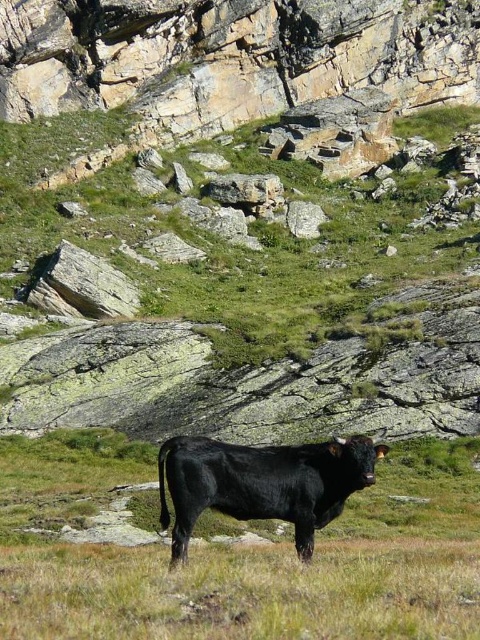
You are a wildlife photographer aiming to capture the black smooth cow at center and the black smooth bull at center in the same frame. Based on their sizes, which animal should you focus on first to ensure both fit in the photo?

The black smooth cow at center is not as tall as the black smooth bull at center, so you should focus on the black smooth bull at center first to ensure both fit in the photo.

You are a hiker who wants to take a photo of the black smooth cow at center and the black smooth bull at center. Which one should you focus on first if you want to capture both in the same frame without moving your camera?

The black smooth cow at center is positioned under the black smooth bull at center, so you should focus on the black smooth bull at center first to ensure both are in focus since it is closer to the camera.